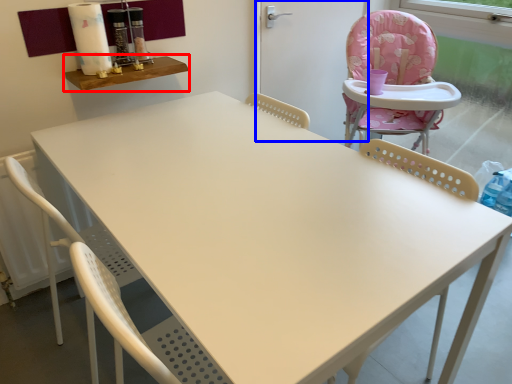
Question: Which point is further to the camera, table (highlighted by a red box) or screen door (highlighted by a blue box)?

Choices:
 (A) table
 (B) screen door

Answer: (B)